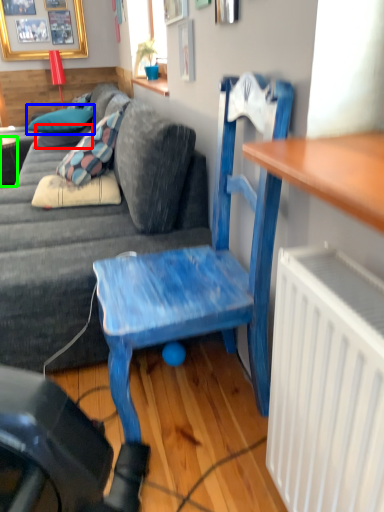
Question: Estimate the real-world distances between objects in this image. Which object is farther from pillow (highlighted by a red box), pillow (highlighted by a blue box) or desk (highlighted by a green box)?

Choices:
 (A) pillow
 (B) desk

Answer: (B)